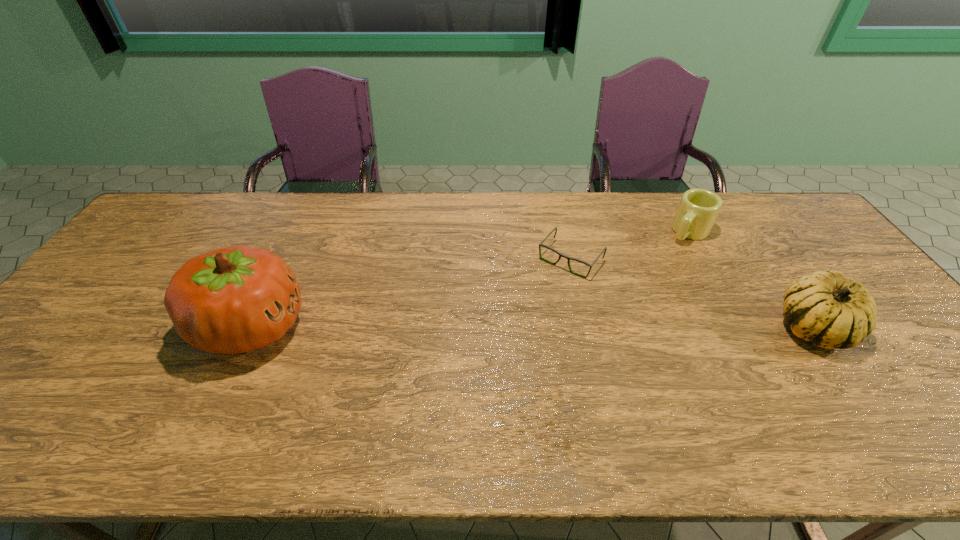
The image size is (960, 540). I want to click on free spot on the desktop that is between the leftmost object and the second tallest object and is positioned with the handle on the side of the mug, so click(x=602, y=327).

Identify the location of vacant space on the desktop that is between the tallest object and the second tallest object and is positioned on the lens of the spectacles. The width and height of the screenshot is (960, 540). (514, 327).